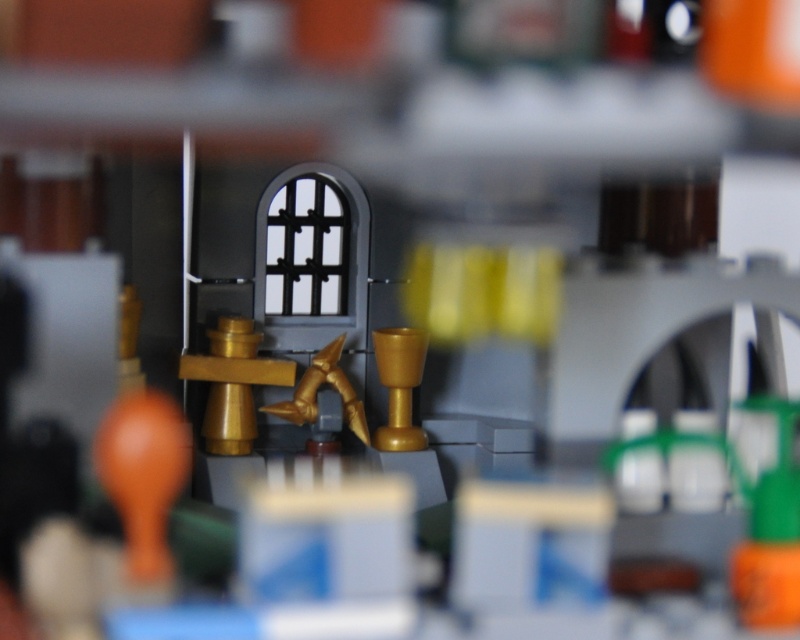
You are a child holding a matte orange balloon at lower left and a gold metallic chalice at center. Which object is wider?

The gold metallic chalice at center is wider than the matte orange balloon at lower left.

You are an architect designing a miniature LEGO castle. You have a matte orange balloon at lower left that needs to be placed at coordinate point 0.742, 0.180. Is this balloon within the designated area for decorations in the lower left quadrant?

The matte orange balloon at lower left is positioned exactly at point (144, 474), so it is within the designated area for decorations in the lower left quadrant.

You are a child at a party holding the matte orange balloon at lower left and the gold metallic chalice at center. Which object is taller?

The gold metallic chalice at center is taller than the matte orange balloon at lower left.